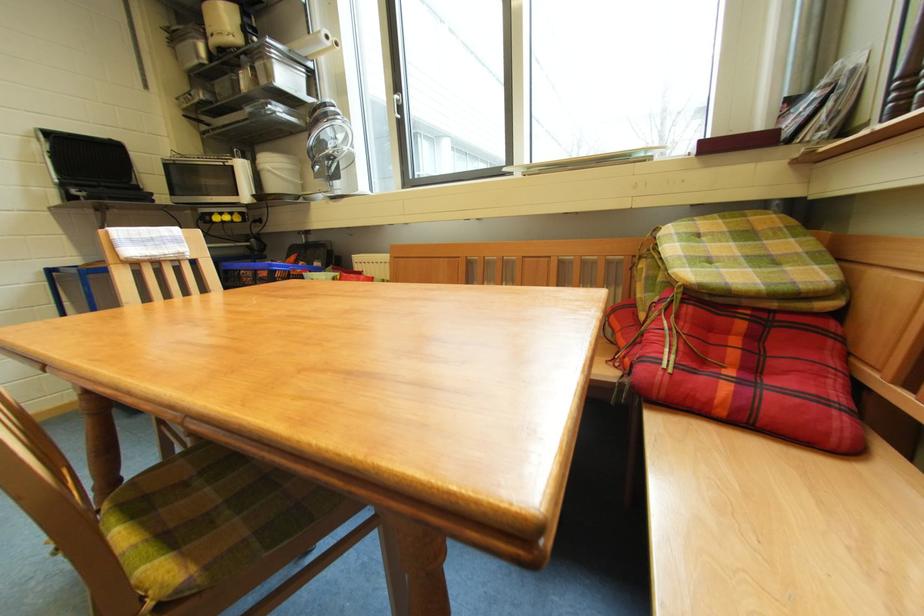
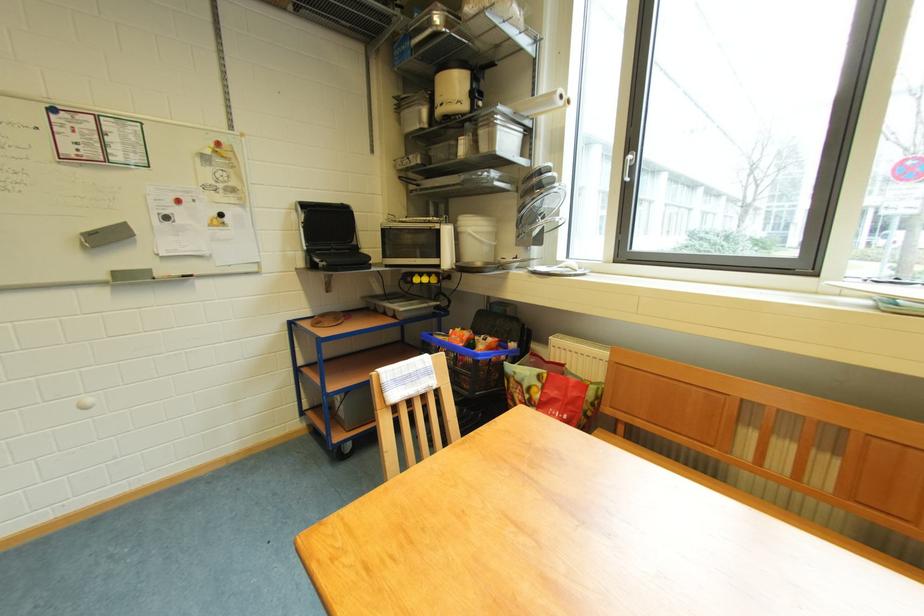
Question: The camera is either moving clockwise (left) or counter-clockwise (right) around the object. The first image is from the beginning of the video and the second image is from the end. Is the camera moving left or right when shooting the video?

Choices:
 (A) Left
 (B) Right

Answer: (B)